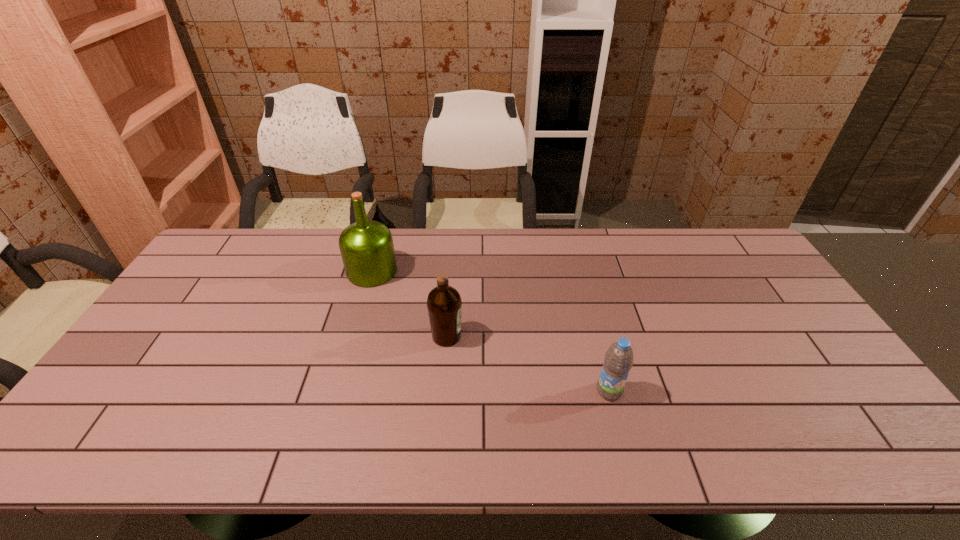
Where is `the farther olive oil`? The width and height of the screenshot is (960, 540). the farther olive oil is located at coordinates (367, 250).

Find the location of `the leftmost object`. the leftmost object is located at coordinates (367, 250).

Image resolution: width=960 pixels, height=540 pixels. What are the coordinates of `the nearer olive oil` in the screenshot? It's located at (444, 304).

Locate an element on the screen. the second object from left to right is located at coordinates (444, 304).

You are a GUI agent. You are given a task and a screenshot of the screen. Output one action in this format:
    pyautogui.click(x=<x>, y=<y>)
    Task: Click on the shortest object
    
    Given the screenshot: What is the action you would take?
    pyautogui.click(x=618, y=359)

The height and width of the screenshot is (540, 960). Find the location of `the nearest object`. the nearest object is located at coordinates (618, 359).

The width and height of the screenshot is (960, 540). Identify the location of vacant position located 0.140m on the left of the taller olive oil. (304, 271).

In order to click on vacant space situated 0.320m on the label of the nearer olive oil in this screenshot , I will do `click(576, 336)`.

You are a GUI agent. You are given a task and a screenshot of the screen. Output one action in this format:
    pyautogui.click(x=<x>, y=<y>)
    Task: Click on the free region located on the right of the shortest object
    The image size is (960, 540).
    Given the screenshot: What is the action you would take?
    pyautogui.click(x=726, y=391)

At what (x,y) coordinates should I click in order to perform the action: click on object present at the far edge. Please return your answer as a coordinate pair (x, y). Looking at the image, I should click on point(367,250).